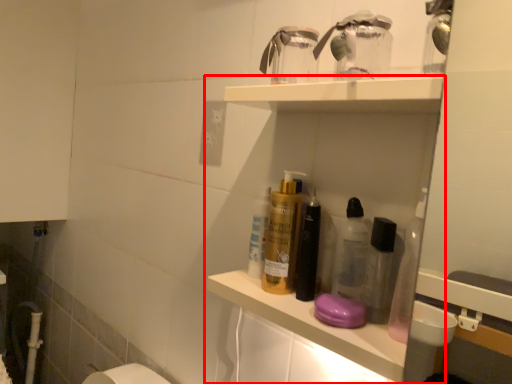
Question: From the image's perspective, considering the relative positions of shelf (annotated by the red box) and electric outlet in the image provided, where is shelf (annotated by the red box) located with respect to the staircase?

Choices:
 (A) below
 (B) above

Answer: (A)